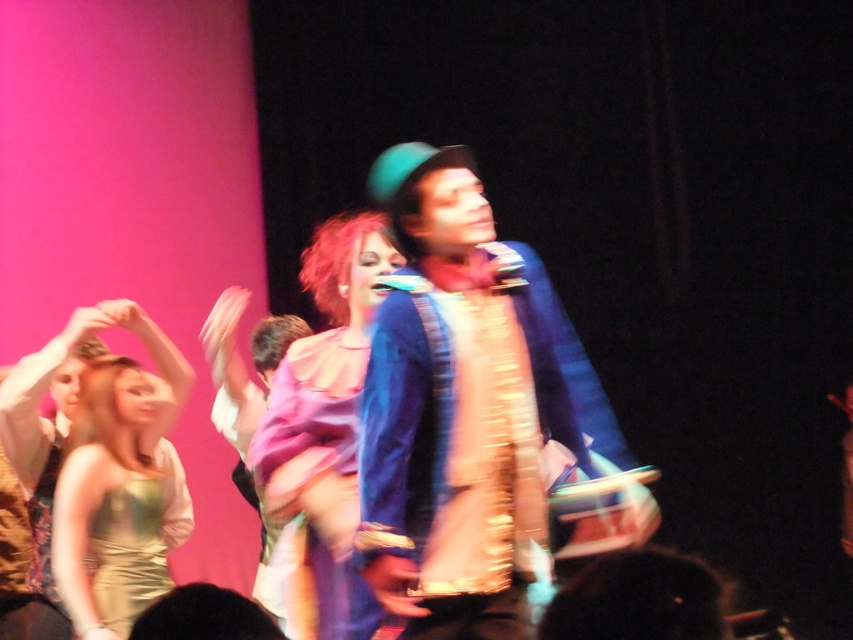
You are a photographer trying to capture a clear shot of the performers. You notice the matte pink dress at center and the gold shiny dress at left. Which dress should you focus on to ensure it appears larger in your photo?

The matte pink dress at center is much taller than the gold shiny dress at left, so focusing on the matte pink dress at center will make it appear larger in the photo.